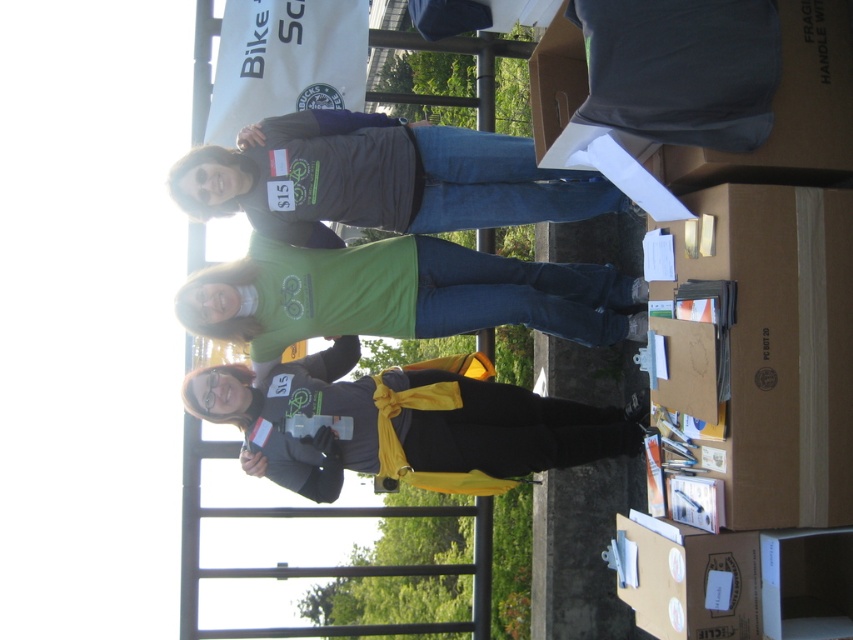
Find the location of `green matte shirt at center`. green matte shirt at center is located at coordinates coord(398,296).

Which is in front, point (219, 301) or point (761, 536)?

Point (761, 536) is more forward.

Image resolution: width=853 pixels, height=640 pixels. Identify the location of green matte shirt at center. (398, 296).

The image size is (853, 640). What do you see at coordinates (764, 349) in the screenshot?
I see `brown cardboard box at lower right` at bounding box center [764, 349].

Does brown cardboard box at lower right have a greater width compared to matte gray shirt at center?

No.

Which is behind, point (732, 248) or point (451, 170)?

Positioned behind is point (451, 170).

The height and width of the screenshot is (640, 853). In order to click on brown cardboard box at lower right in this screenshot , I will do `click(764, 349)`.

Who is positioned more to the left, matte black jacket at center or cardboard box at lower right?

matte black jacket at center

From the picture: Is matte black jacket at center to the left of cardboard box at lower right from the viewer's perspective?

Yes, matte black jacket at center is to the left of cardboard box at lower right.

Who is more forward, (x=616, y=438) or (x=751, y=582)?

Point (x=751, y=582) is more forward.

At what (x,y) coordinates should I click in order to perform the action: click on matte black jacket at center. Please return your answer as a coordinate pair (x, y). The height and width of the screenshot is (640, 853). Looking at the image, I should click on (401, 422).